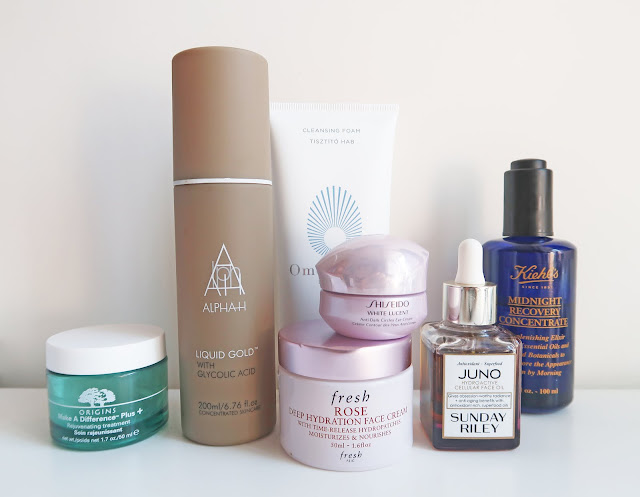
I want to click on shadow on wall, so click(x=454, y=225).